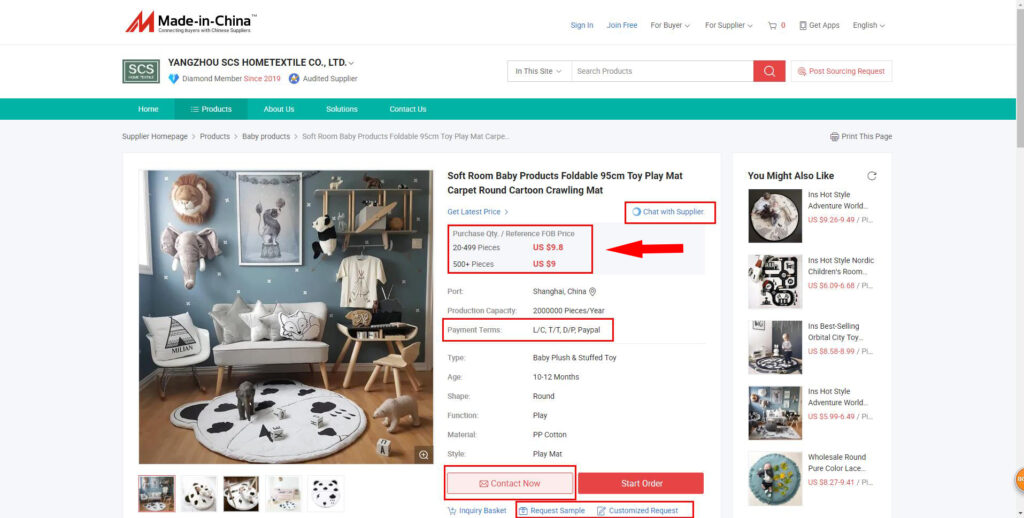
Where is `blue gray wall`? blue gray wall is located at coordinates (251, 281).